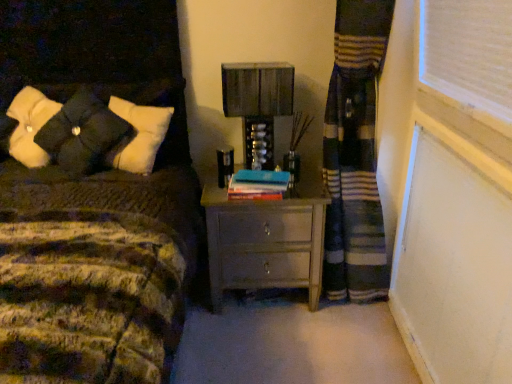
Question: Is matte gray nightstand at center in front of or behind velvety black pillows at upper left in the image?

Choices:
 (A) front
 (B) behind

Answer: (B)

Question: Considering the positions of matte gray nightstand at center and velvety black pillows at upper left in the image, is matte gray nightstand at center bigger or smaller than velvety black pillows at upper left?

Choices:
 (A) big
 (B) small

Answer: (A)

Question: Based on their relative distances, which object is nearer to the blue matte book at center?

Choices:
 (A) velvety black pillows at upper left
 (B) matte gray nightstand at center
 (C) metallic silver table lamp at center

Answer: (C)

Question: Which object is the farthest from the velvety black pillows at upper left?

Choices:
 (A) matte gray nightstand at center
 (B) metallic silver table lamp at center
 (C) blue matte book at center

Answer: (A)